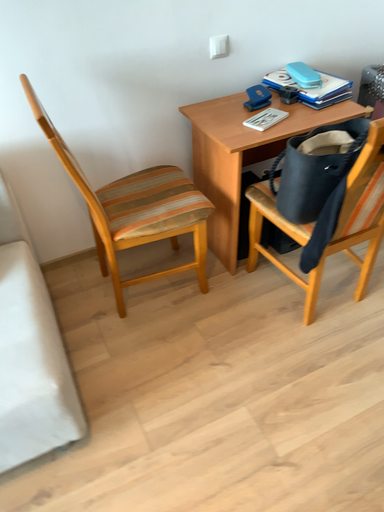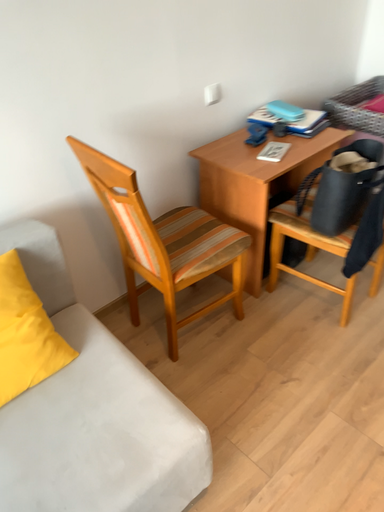
Question: Which way did the camera rotate in the video?

Choices:
 (A) rotated right
 (B) rotated left

Answer: (A)